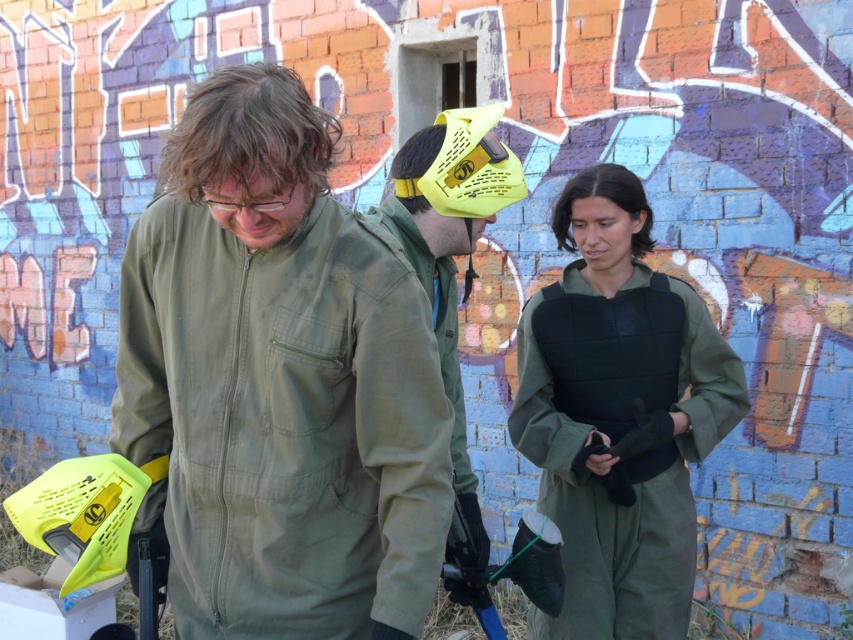
You are an observer standing in front of the brick wall with graffiti. You notice the olive green fabric jacket at center and the matte yellow helmet at center. Which object is positioned higher relative to the other?

The olive green fabric jacket at center is located above the matte yellow helmet at center, so it is positioned higher.

Consider the image. You are an observer standing in front of the brick wall with colorful graffiti. You notice two items at the center of the image. Which item is shorter in height between the olive green fabric jacket at center and the green matte vest at center?

The olive green fabric jacket at center is not as tall as the green matte vest at center, so the olive green fabric jacket at center is shorter in height.